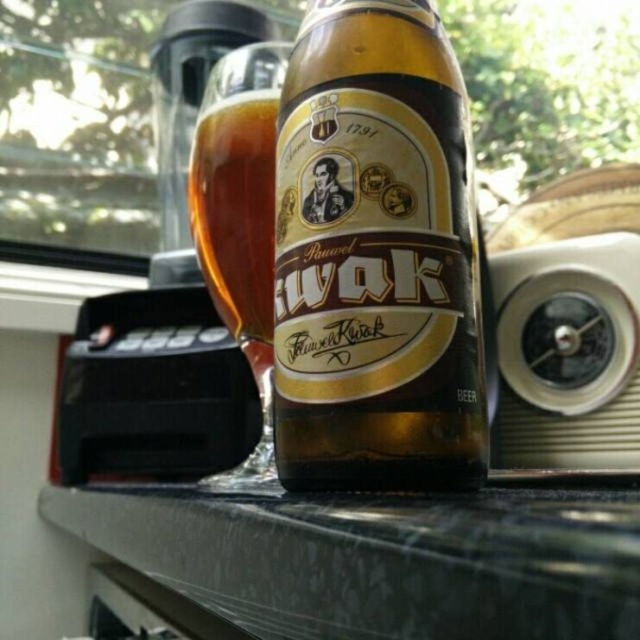
Question: Is brown glass beer bottle at center wider than amber glass mug at upper center?

Choices:
 (A) no
 (B) yes

Answer: (B)

Question: Is black marble counter at center closer to the viewer compared to amber glass mug at upper center?

Choices:
 (A) no
 (B) yes

Answer: (B)

Question: Does black marble counter at center have a lesser width compared to amber glass mug at upper center?

Choices:
 (A) no
 (B) yes

Answer: (A)

Question: Among these objects, which one is nearest to the camera?

Choices:
 (A) brown glass beer bottle at center
 (B) black marble counter at center

Answer: (B)

Question: Which point is closer to the camera?

Choices:
 (A) (260, 609)
 (B) (248, 189)
 (C) (364, 321)

Answer: (A)

Question: Which point is closer to the camera?

Choices:
 (A) (228, 140)
 (B) (291, 76)
 (C) (180, 582)

Answer: (C)